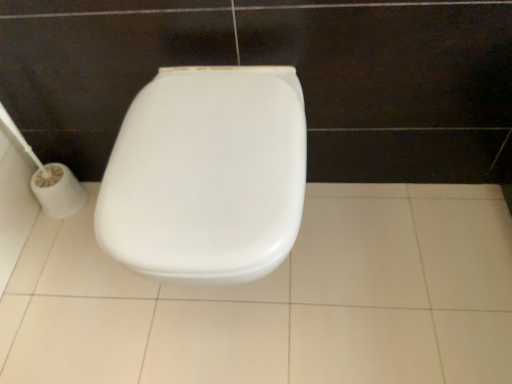
I want to click on unoccupied area in front of white plastic toilet paper at left, so click(57, 256).